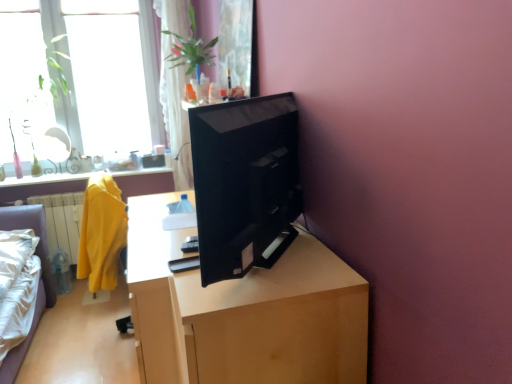
Question: Considering the positions of wooden desk at center and matte yellow robe at left in the image, is wooden desk at center wider or thinner than matte yellow robe at left?

Choices:
 (A) thin
 (B) wide

Answer: (B)

Question: Based on their positions, is wooden desk at center located to the left or right of matte yellow robe at left?

Choices:
 (A) left
 (B) right

Answer: (B)

Question: Estimate the real-world distances between objects in this image. Which object is closer to the yellow fabric at left?

Choices:
 (A) white sheer curtain at upper center
 (B) matte yellow robe at left
 (C) black glossy monitor at center
 (D) transparent glass window at upper left
 (E) wooden desk at center

Answer: (D)

Question: Which object is positioned farthest from the white sheer curtain at upper center?

Choices:
 (A) transparent glass window at upper left
 (B) wooden desk at center
 (C) black glossy monitor at center
 (D) yellow fabric at left
 (E) matte yellow robe at left

Answer: (C)